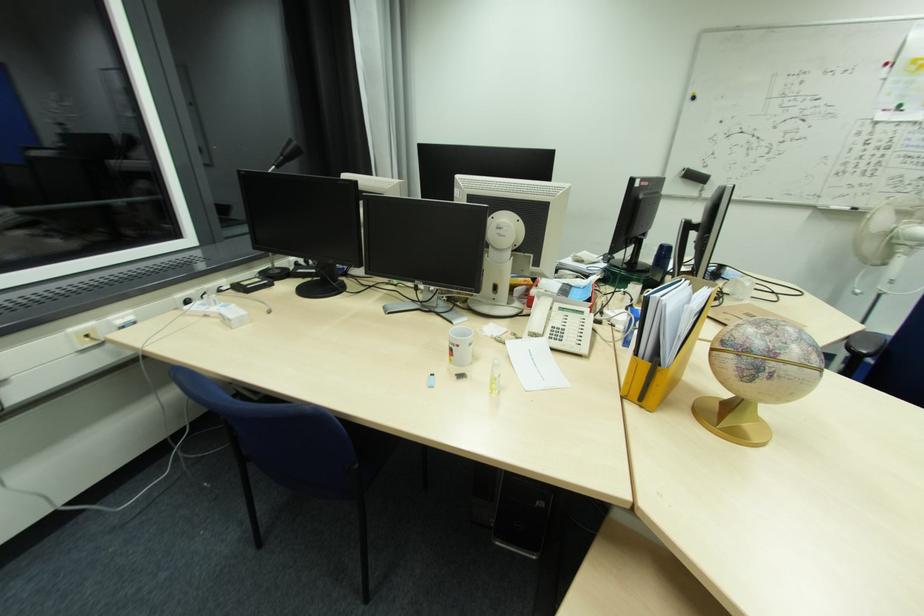
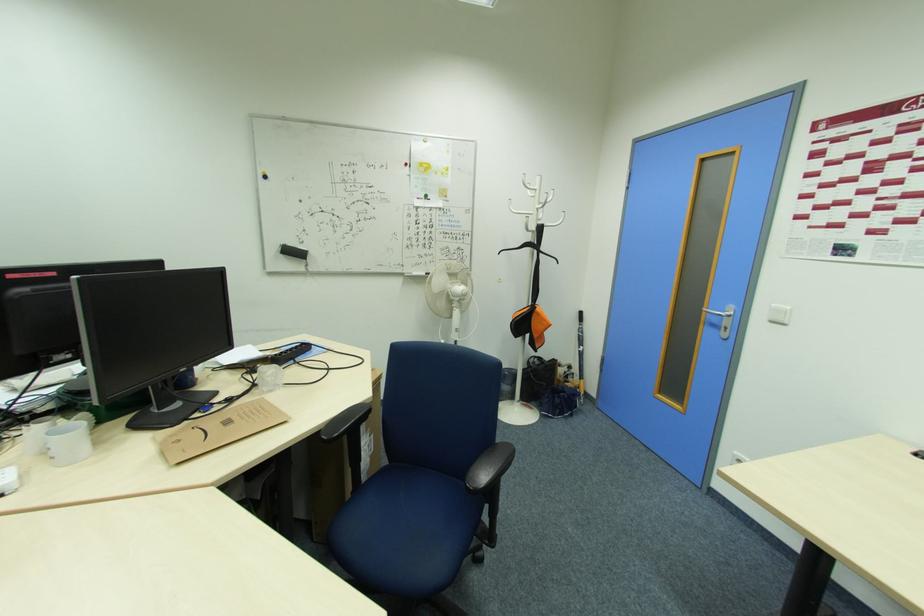
Locate, in the second image, the point that corresponds to pixel 697 169 in the first image.

(294, 246)